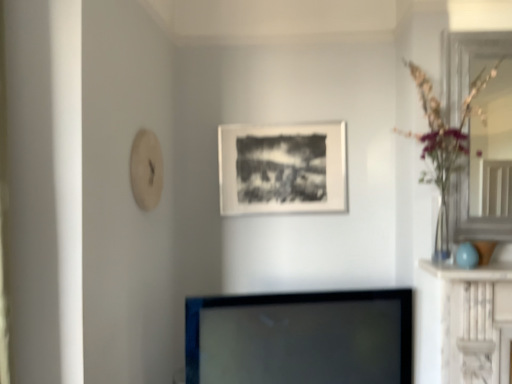
What do you see at coordinates (282, 168) in the screenshot? Image resolution: width=512 pixels, height=384 pixels. I see `matte black picture frame at center` at bounding box center [282, 168].

The image size is (512, 384). Find the location of `clear glass door at right`. clear glass door at right is located at coordinates (480, 135).

Is matte black picture frame at center not inside clear glass door at right?

Absolutely, matte black picture frame at center is external to clear glass door at right.

Is point (341, 178) closer or farther from the camera than point (485, 184)?

Point (341, 178) is positioned farther from the camera compared to point (485, 184).

How different are the orientations of matte black picture frame at center and clear glass door at right in degrees?

0.0803 degrees separate the facing orientations of matte black picture frame at center and clear glass door at right.

At what (x,y) coordinates should I click in order to perform the action: click on television located behind the clear glass vase at right. Please return your answer as a coordinate pair (x, y). This screenshot has height=384, width=512. Looking at the image, I should click on point(300,338).

Between clear glass vase at right and black glossy tv at center, which one appears on the left side from the viewer's perspective?

From the viewer's perspective, black glossy tv at center appears more on the left side.

How much distance is there between clear glass vase at right and black glossy tv at center?

clear glass vase at right and black glossy tv at center are 28.31 inches apart from each other.

From a real-world perspective, who is located higher, clear glass vase at right or black glossy tv at center?

clear glass vase at right is physically above.

Can you confirm if black glossy tv at center is thinner than clear glass door at right?

In fact, black glossy tv at center might be wider than clear glass door at right.

Considering the relative positions of black glossy tv at center and clear glass door at right in the image provided, is black glossy tv at center to the right of clear glass door at right from the viewer's perspective?

No.

You are a GUI agent. You are given a task and a screenshot of the screen. Output one action in this format:
    pyautogui.click(x=<x>, y=<y>)
    Task: Click on the glass door above the black glossy tv at center (from the image's perspective)
    
    Given the screenshot: What is the action you would take?
    pyautogui.click(x=480, y=135)

Is clear glass door at right in front of or behind black glossy tv at center in the image?

clear glass door at right is behind black glossy tv at center.

Based on the photo, considering the sizes of objects clear glass door at right and black glossy tv at center in the image provided, who is smaller, clear glass door at right or black glossy tv at center?

Smaller between the two is clear glass door at right.

Considering the sizes of clear glass door at right and black glossy tv at center in the image, is clear glass door at right taller or shorter than black glossy tv at center?

Considering their sizes, clear glass door at right has more height than black glossy tv at center.

From a real-world perspective, is clear glass door at right positioned above or below black glossy tv at center?

Clearly, from a real-world perspective, clear glass door at right is above black glossy tv at center.

From a real-world perspective, is clear glass vase at right physically below clear glass door at right?

Indeed, from a real-world perspective, clear glass vase at right is positioned beneath clear glass door at right.

How distant is clear glass vase at right from clear glass door at right?

clear glass vase at right is 9.27 centimeters away from clear glass door at right.

Is point (448, 131) less distant than point (462, 182)?

Yes, point (448, 131) is in front of point (462, 182).

Is clear glass vase at right positioned with its back to clear glass door at right?

Yes, clear glass vase at right is positioned with its back facing clear glass door at right.

Can you confirm if matte black picture frame at center is wider than clear glass vase at right?

In fact, matte black picture frame at center might be narrower than clear glass vase at right.

Between point (265, 189) and point (448, 131), which one is positioned behind?

The point (265, 189) is farther from the camera.

From the image's perspective, is matte black picture frame at center located above clear glass vase at right?

Actually, matte black picture frame at center appears below clear glass vase at right in the image.

Can you confirm if matte black picture frame at center is taller than clear glass vase at right?

No.

Is there a large distance between black glossy tv at center and matte black picture frame at center?

No, black glossy tv at center is in close proximity to matte black picture frame at center.

How many degrees apart are the facing directions of black glossy tv at center and matte black picture frame at center?

The angle between the facing direction of black glossy tv at center and the facing direction of matte black picture frame at center is 17 degrees.

How distant is black glossy tv at center from matte black picture frame at center?

black glossy tv at center and matte black picture frame at center are 30.58 inches apart.

Considering the relative positions of black glossy tv at center and matte black picture frame at center in the image provided, is black glossy tv at center to the right of matte black picture frame at center from the viewer's perspective?

Yes.

The height and width of the screenshot is (384, 512). Identify the location of glass door to the right of matte black picture frame at center. (480, 135).

Image resolution: width=512 pixels, height=384 pixels. In order to click on floral arrangement above the black glossy tv at center (from the image's perspective) in this screenshot , I will do `click(444, 144)`.

Based on their spatial positions, is clear glass door at right or black glossy tv at center further from clear glass vase at right?

black glossy tv at center lies further to clear glass vase at right than the other object.

Looking at the image, which one is located closer to clear glass door at right, black glossy tv at center or matte black picture frame at center?

matte black picture frame at center lies closer to clear glass door at right than the other object.

Based on the photo, considering their positions, is matte black picture frame at center positioned further to black glossy tv at center than clear glass door at right?

clear glass door at right is positioned further to the anchor black glossy tv at center.

Which object lies further to the anchor point black glossy tv at center, clear glass door at right or matte black picture frame at center?

The object further to black glossy tv at center is clear glass door at right.

Which object lies further to the anchor point matte black picture frame at center, clear glass vase at right or black glossy tv at center?

Among the two, black glossy tv at center is located further to matte black picture frame at center.

When comparing their distances from clear glass door at right, does matte black picture frame at center or clear glass vase at right seem closer?

The object closer to clear glass door at right is clear glass vase at right.

Estimate the real-world distances between objects in this image. Which object is closer to black glossy tv at center, clear glass vase at right or clear glass door at right?

The object closer to black glossy tv at center is clear glass vase at right.

Estimate the real-world distances between objects in this image. Which object is closer to clear glass vase at right, clear glass door at right or matte black picture frame at center?

clear glass door at right.

Locate an element on the screen. The image size is (512, 384). picture frame between clear glass vase at right and black glossy tv at center vertically is located at coordinates (282, 168).

Locate an element on the screen. The height and width of the screenshot is (384, 512). floral arrangement situated between matte black picture frame at center and clear glass door at right from left to right is located at coordinates (444, 144).

The height and width of the screenshot is (384, 512). Identify the location of picture frame between clear glass door at right and black glossy tv at center in the up-down direction. (282, 168).

At what (x,y) coordinates should I click in order to perform the action: click on floral arrangement between clear glass door at right and black glossy tv at center from top to bottom. Please return your answer as a coordinate pair (x, y). The width and height of the screenshot is (512, 384). Looking at the image, I should click on (444, 144).